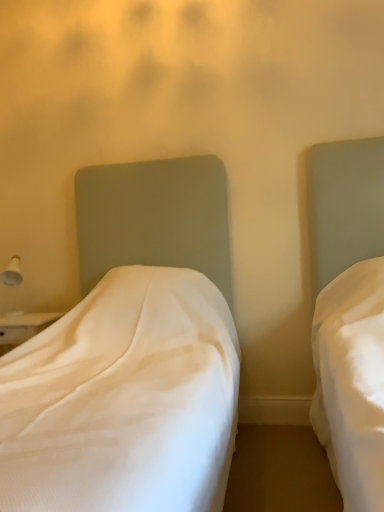
Question: Does matte white bed at right, acting as the first bed starting from the right, have a greater height compared to white glossy lampshade at left?

Choices:
 (A) no
 (B) yes

Answer: (B)

Question: Does matte white bed at right, placed as the second bed when sorted from left to right, have a greater width compared to white glossy lampshade at left?

Choices:
 (A) yes
 (B) no

Answer: (A)

Question: Considering the relative sizes of matte white bed at right, placed as the second bed when sorted from left to right, and white glossy lampshade at left in the image provided, is matte white bed at right, placed as the second bed when sorted from left to right, shorter than white glossy lampshade at left?

Choices:
 (A) yes
 (B) no

Answer: (B)

Question: Is white glossy lampshade at left completely or partially inside matte white bed at right, placed as the second bed when sorted from left to right?

Choices:
 (A) yes
 (B) no

Answer: (B)

Question: Is matte white bed at right, acting as the first bed starting from the right, not within white glossy lampshade at left?

Choices:
 (A) yes
 (B) no

Answer: (A)

Question: Relative to white fabric bed at left, the 1th bed positioned from the left, is matte white bed at right, acting as the first bed starting from the right, in front or behind?

Choices:
 (A) front
 (B) behind

Answer: (A)

Question: In terms of size, does matte white bed at right, placed as the second bed when sorted from left to right, appear bigger or smaller than white fabric bed at left, the 1th bed positioned from the left?

Choices:
 (A) big
 (B) small

Answer: (B)

Question: From a real-world perspective, is matte white bed at right, placed as the second bed when sorted from left to right, positioned above or below white fabric bed at left, which appears as the second bed when viewed from the right?

Choices:
 (A) below
 (B) above

Answer: (B)

Question: Considering the relative positions of matte white bed at right, placed as the second bed when sorted from left to right, and white fabric bed at left, which appears as the second bed when viewed from the right, in the image provided, is matte white bed at right, placed as the second bed when sorted from left to right, to the left or to the right of white fabric bed at left, which appears as the second bed when viewed from the right,?

Choices:
 (A) left
 (B) right

Answer: (B)

Question: Is matte white bed at right, placed as the second bed when sorted from left to right, in front of or behind white glossy lampshade at left in the image?

Choices:
 (A) behind
 (B) front

Answer: (B)

Question: From a real-world perspective, relative to white glossy lampshade at left, is matte white bed at right, acting as the first bed starting from the right, vertically above or below?

Choices:
 (A) below
 (B) above

Answer: (A)

Question: Considering the positions of point (377, 361) and point (18, 269), is point (377, 361) closer or farther from the camera than point (18, 269)?

Choices:
 (A) farther
 (B) closer

Answer: (B)

Question: In terms of size, does matte white bed at right, placed as the second bed when sorted from left to right, appear bigger or smaller than white glossy lampshade at left?

Choices:
 (A) small
 (B) big

Answer: (B)

Question: In terms of height, does white fabric bed at left, the 1th bed positioned from the left, look taller or shorter compared to white glossy lampshade at left?

Choices:
 (A) tall
 (B) short

Answer: (A)

Question: From a real-world perspective, is white fabric bed at left, the 1th bed positioned from the left, physically located above or below white glossy lampshade at left?

Choices:
 (A) above
 (B) below

Answer: (B)